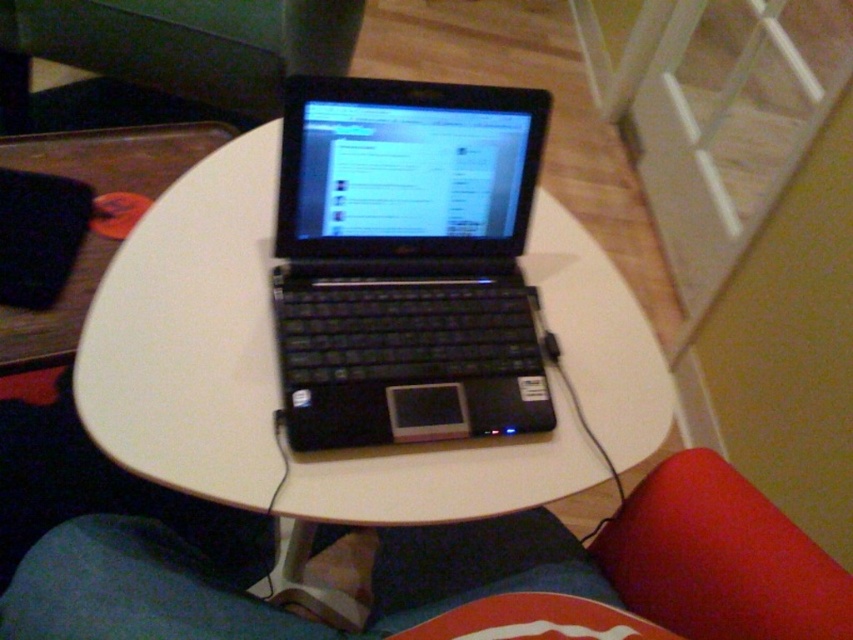
Question: Is white matte round table at center below blue fabric at center?

Choices:
 (A) no
 (B) yes

Answer: (A)

Question: Where is white matte round table at center located in relation to blue fabric at center in the image?

Choices:
 (A) right
 (B) left

Answer: (B)

Question: Is black matte laptop at center positioned in front of blue fabric at center?

Choices:
 (A) yes
 (B) no

Answer: (B)

Question: Based on their relative distances, which object is nearer to the white matte round table at center?

Choices:
 (A) black matte laptop at center
 (B) blue fabric at center

Answer: (A)

Question: Which point is farther to the camera?

Choices:
 (A) black matte laptop at center
 (B) white matte round table at center

Answer: (A)

Question: Considering the real-world distances, which object is farthest from the black matte laptop at center?

Choices:
 (A) white matte round table at center
 (B) blue fabric at center

Answer: (B)